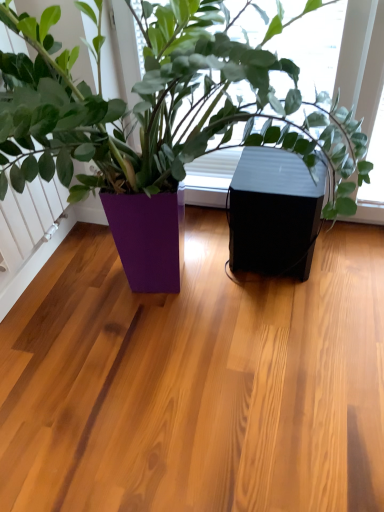
Image resolution: width=384 pixels, height=512 pixels. I want to click on unoccupied area in front of black matte speaker at center, so click(x=288, y=312).